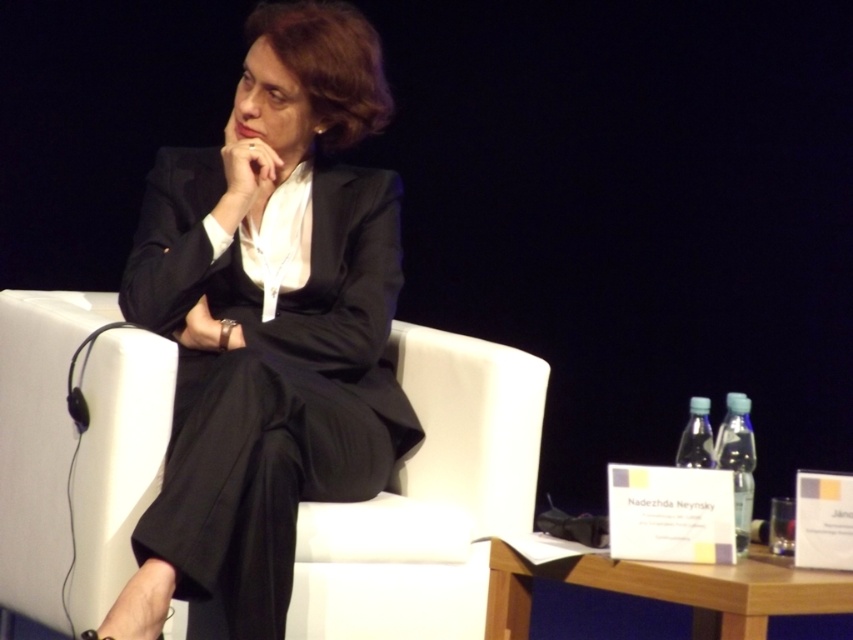
Does point (376, 339) lie behind point (368, 604)?

That is True.

Can you confirm if black pinstripe suit at center is shorter than white fabric armchair at center?

No.

Where is `black pinstripe suit at center`? This screenshot has height=640, width=853. black pinstripe suit at center is located at coordinates (268, 323).

The height and width of the screenshot is (640, 853). Identify the location of black pinstripe suit at center. (268, 323).